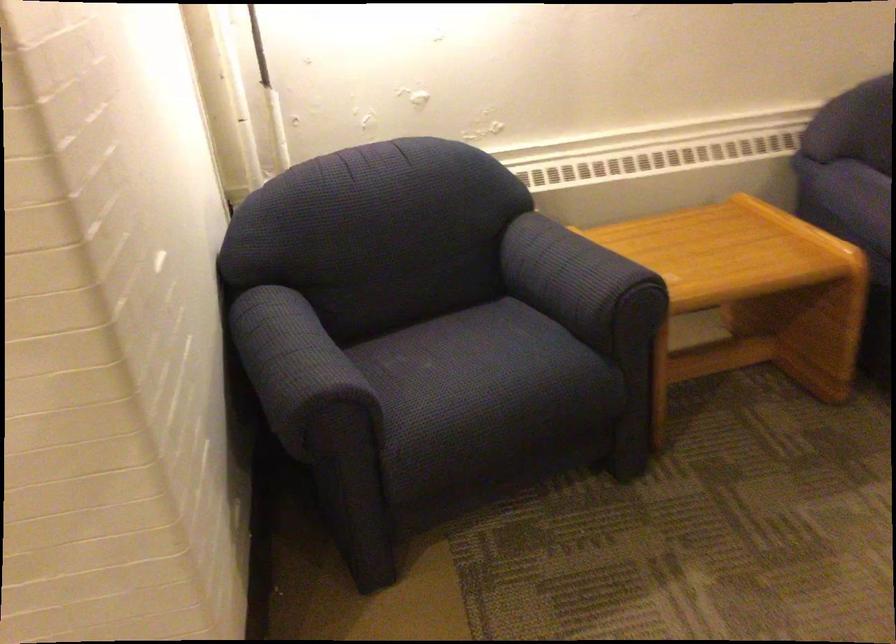
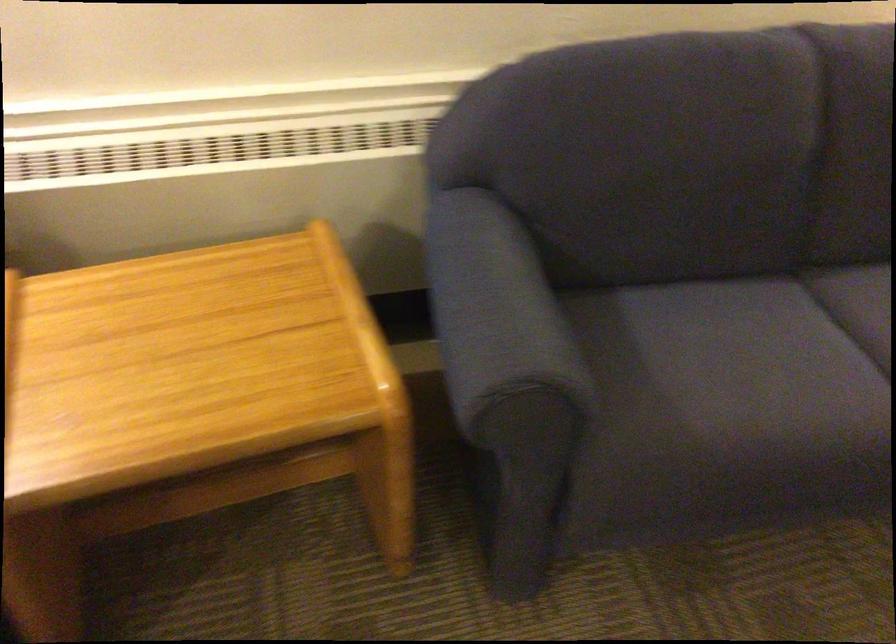
What movement of the cameraman would produce the second image?

The cameraman walked toward right, forward.